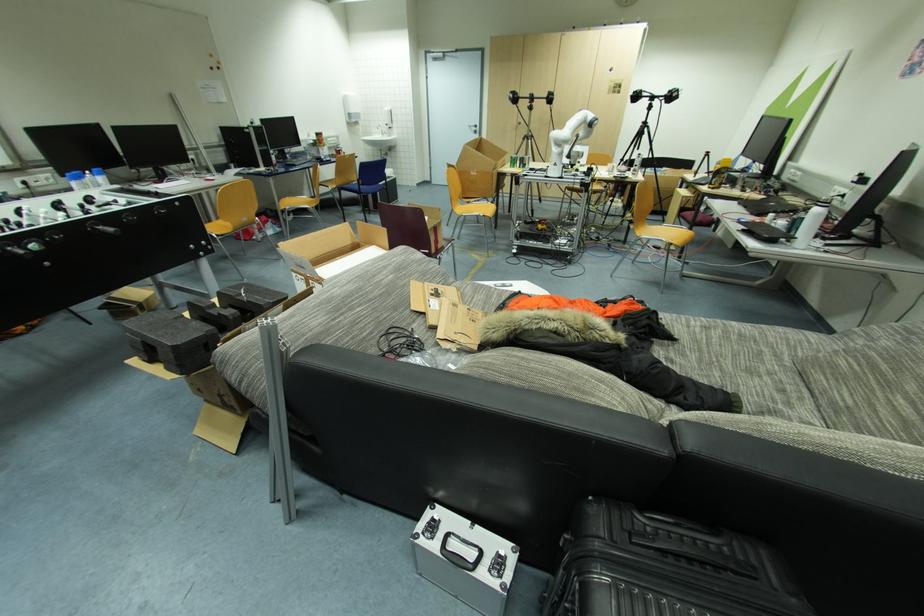
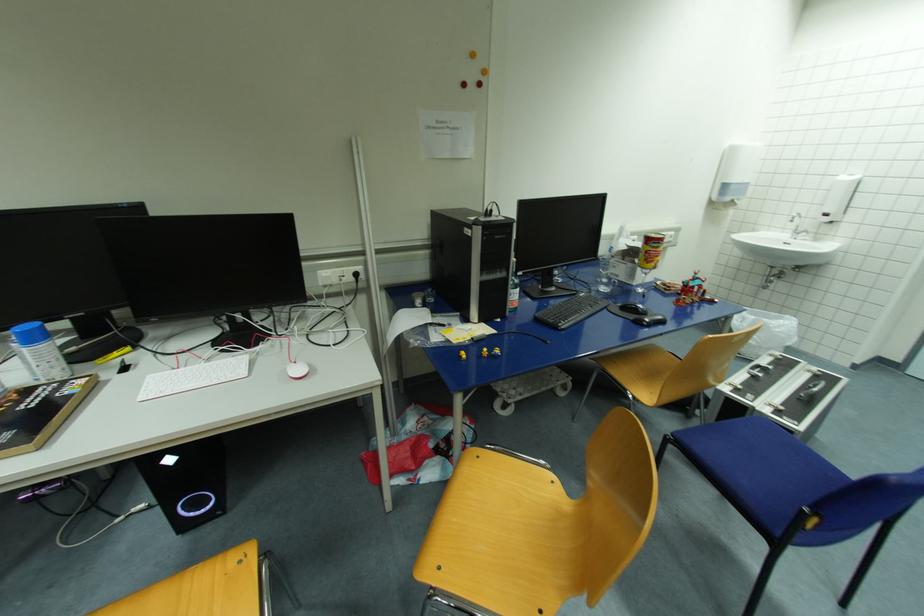
In the second image, find the point that corresponds to the point at 386,135 in the first image.

(799, 233)